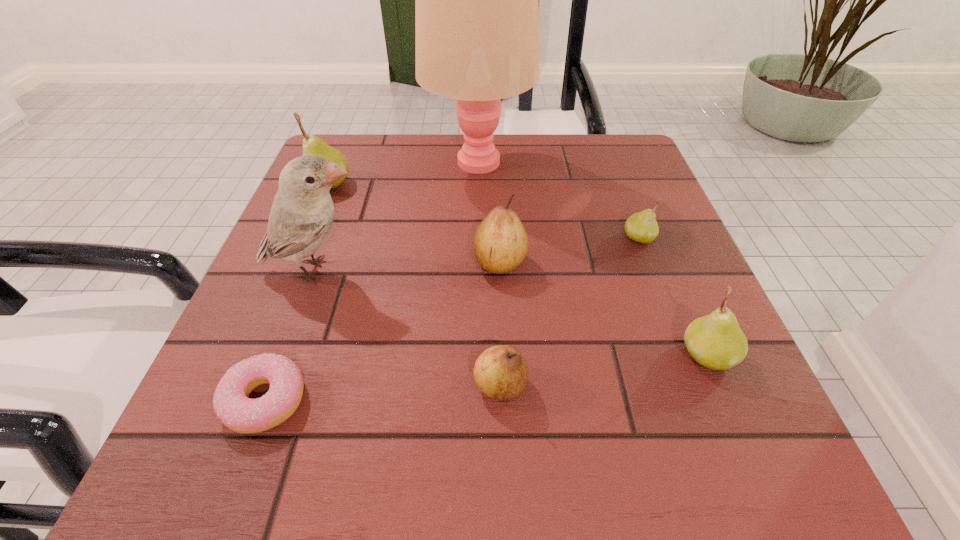
The image size is (960, 540). Find the location of `pink lampshade`. pink lampshade is located at coordinates (476, 0).

You are a GUI agent. You are given a task and a screenshot of the screen. Output one action in this format:
    pyautogui.click(x=<x>, y=<y>)
    Task: Click on the tallest object
    This screenshot has height=540, width=960.
    Given the screenshot: What is the action you would take?
    pyautogui.click(x=476, y=0)

The width and height of the screenshot is (960, 540). What are the coordinates of `bird` in the screenshot? It's located at (302, 213).

Locate an element on the screen. The height and width of the screenshot is (540, 960). the seventh shortest object is located at coordinates (302, 213).

I want to click on the farthest pear, so click(312, 145).

At what (x,y) coordinates should I click in order to perform the action: click on the third tallest object. Please return your answer as a coordinate pair (x, y). This screenshot has width=960, height=540. Looking at the image, I should click on (312, 145).

Locate an element on the screen. the farther brown pear is located at coordinates (500, 243).

Locate an element on the screen. This screenshot has height=540, width=960. the second biggest green pear is located at coordinates (715, 341).

Image resolution: width=960 pixels, height=540 pixels. I want to click on the second nearest green pear, so click(642, 227).

Where is `the nearer brown pear`? the nearer brown pear is located at coordinates (501, 372).